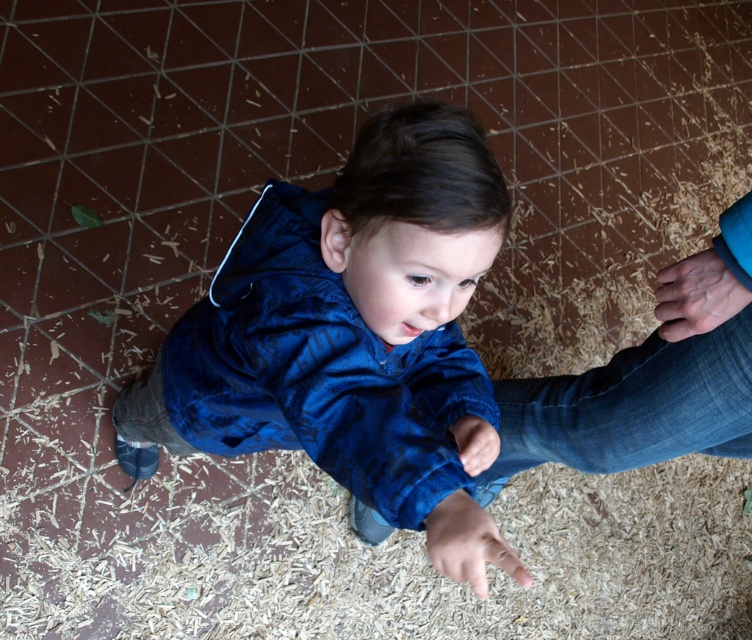
Question: Is denim at lower right above smooth skin hand at center?

Choices:
 (A) yes
 (B) no

Answer: (B)

Question: Among these points, which one is farthest from the camera?

Choices:
 (A) (x=740, y=433)
 (B) (x=435, y=538)
 (C) (x=434, y=118)
 (D) (x=663, y=305)

Answer: (A)

Question: Which point is closer to the camera taking this photo?

Choices:
 (A) (496, 566)
 (B) (478, 154)
 (C) (675, 371)
 (D) (690, 301)

Answer: (B)

Question: Which of the following is the farthest from the observer?

Choices:
 (A) smooth skin hand at lower right
 (B) blue velvety jacket at center

Answer: (A)

Question: Does blue velvety jacket at center have a greater width compared to smooth skin hand at lower right?

Choices:
 (A) no
 (B) yes

Answer: (B)

Question: Is blue velvety jacket at center above smooth skin hand at center?

Choices:
 (A) no
 (B) yes

Answer: (B)